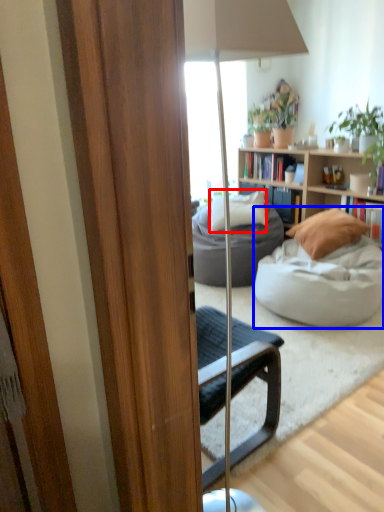
Question: Which of the following is the closest to the observer, pillow (highlighted by a red box) or studio couch (highlighted by a blue box)?

Choices:
 (A) pillow
 (B) studio couch

Answer: (B)